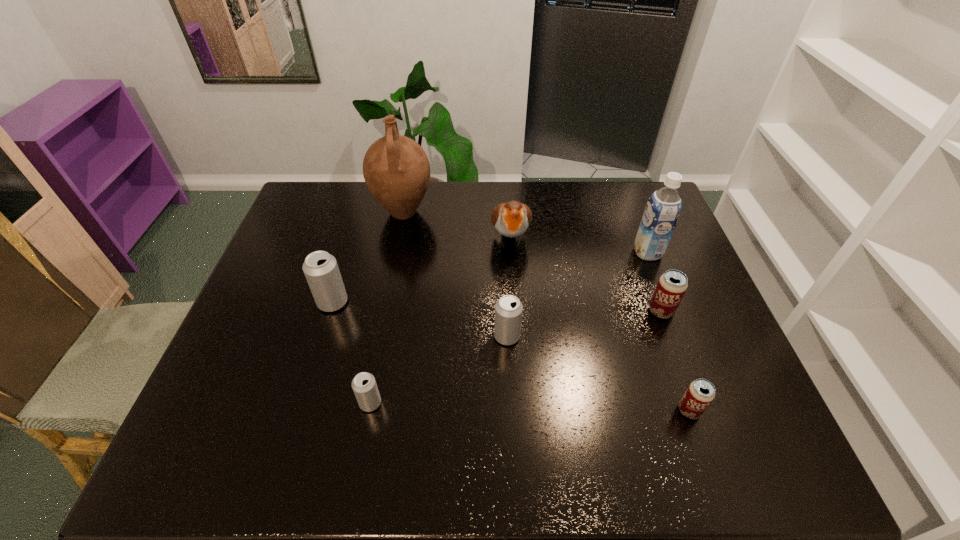
This screenshot has height=540, width=960. Find the location of `free space between the bird and the farther red beer can`. free space between the bird and the farther red beer can is located at coordinates (586, 275).

Identify which object is located as the seventh nearest to the pitcher. Please provide its 2D coordinates. Your answer should be formatted as a tuple, i.e. [(x, y)], where the tuple contains the x and y coordinates of a point satisfying the conditions above.

[(701, 392)]

Identify which object is the nearest to the bird. Please provide its 2D coordinates. Your answer should be formatted as a tuple, i.e. [(x, y)], where the tuple contains the x and y coordinates of a point satisfying the conditions above.

[(396, 169)]

Identify the location of beer can object that ranks as the third closest to the leftmost object. (672, 285).

Point out which beer can is positioned as the second nearest to the nearest white beer can. Please provide its 2D coordinates. Your answer should be formatted as a tuple, i.e. [(x, y)], where the tuple contains the x and y coordinates of a point satisfying the conditions above.

[(508, 309)]

The height and width of the screenshot is (540, 960). What are the coordinates of `the third closest white beer can to the soya milk` in the screenshot? It's located at (321, 270).

Identify which white beer can is located as the third nearest to the second tallest object. Please provide its 2D coordinates. Your answer should be formatted as a tuple, i.e. [(x, y)], where the tuple contains the x and y coordinates of a point satisfying the conditions above.

[(321, 270)]

Where is `free space in the image that satisfies the following two spatial constraints: 1. at the face of the smaller red beer can; 2. on the right side of the brown bird`? free space in the image that satisfies the following two spatial constraints: 1. at the face of the smaller red beer can; 2. on the right side of the brown bird is located at coordinates (522, 410).